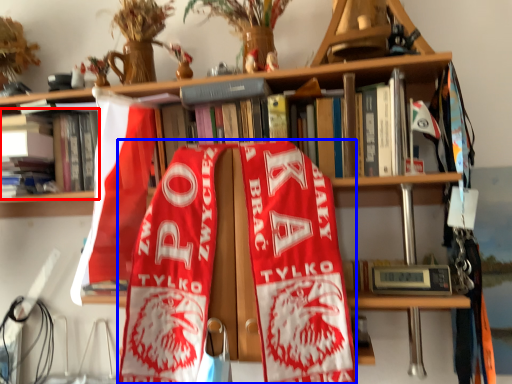
Question: Among these objects, which one is nearest to the camera, book (highlighted by a red box) or beach towel (highlighted by a blue box)?

Choices:
 (A) book
 (B) beach towel

Answer: (B)